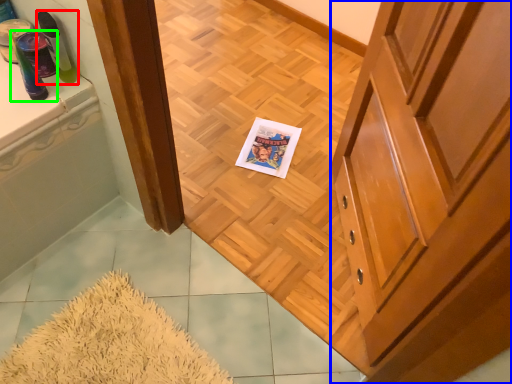
Question: Which object is the farthest from toiletry (highlighted by a red box)? Choose among these: cabinetry (highlighted by a blue box) or toiletry (highlighted by a green box).

Choices:
 (A) cabinetry
 (B) toiletry

Answer: (A)